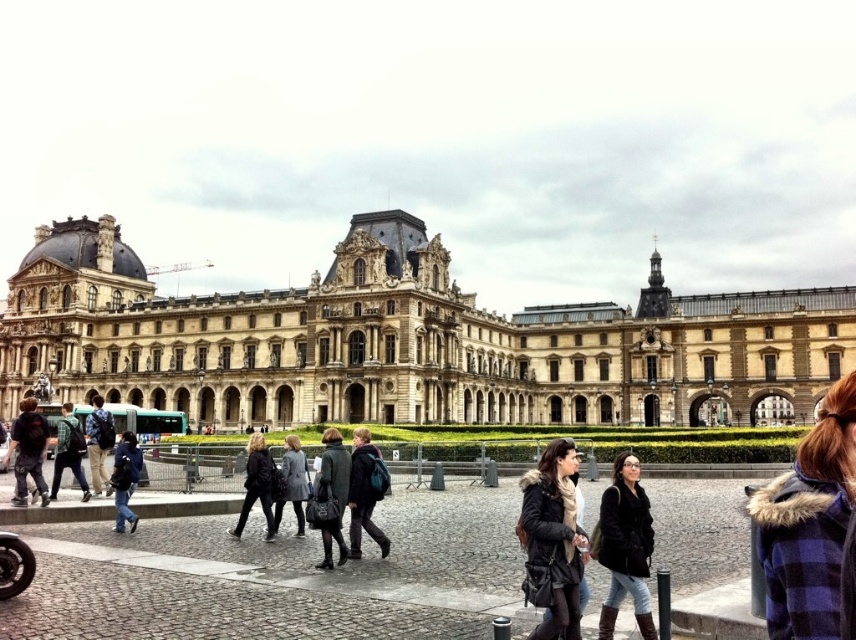
Question: Among these points, which one is nearest to the camera?

Choices:
 (A) (4, 461)
 (B) (302, 465)
 (C) (272, 467)

Answer: (B)

Question: Which object appears closest to the camera in this image?

Choices:
 (A) dark blue backpack at center
 (B) dark gray fabric coat at center
 (C) matte black backpack at center
 (D) black leather jacket at center

Answer: (B)

Question: Can you confirm if beige stone palace at center is bigger than dark gray fabric coat at center?

Choices:
 (A) yes
 (B) no

Answer: (A)

Question: Considering the relative positions of black leather jacket at lower center and dark blue backpack at left in the image provided, where is black leather jacket at lower center located with respect to dark blue backpack at left?

Choices:
 (A) left
 (B) right

Answer: (B)

Question: Among these points, which one is farthest from the camera?

Choices:
 (A) coord(548,445)
 (B) coord(268,477)
 (C) coord(48,314)
 (D) coord(94,484)

Answer: (C)

Question: Can you confirm if dark gray fabric coat at center is wider than gray wool coat at center?

Choices:
 (A) yes
 (B) no

Answer: (B)